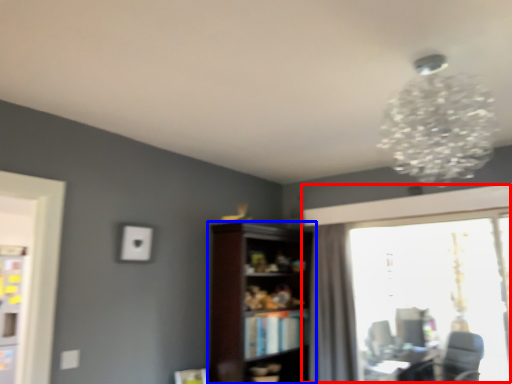
Question: Among these objects, which one is farthest to the camera, window (highlighted by a red box) or shelf (highlighted by a blue box)?

Choices:
 (A) window
 (B) shelf

Answer: (A)